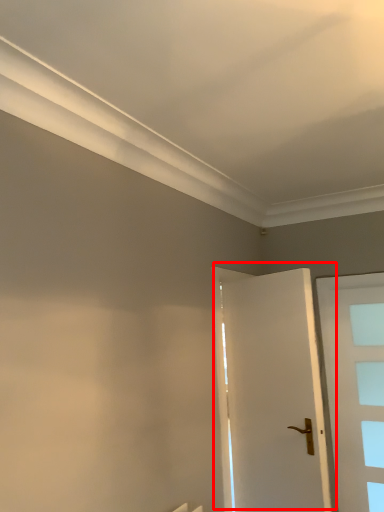
Question: In this image, where is door (annotated by the red box) located relative to door?

Choices:
 (A) left
 (B) right

Answer: (A)